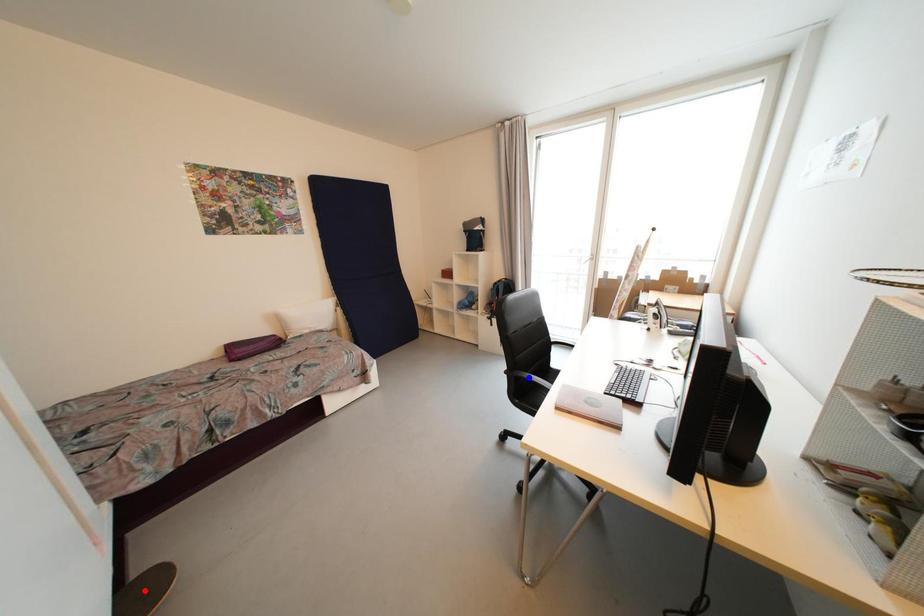
Question: In the image, two points are highlighted. Which point is nearer to the camera? Reply with the corresponding letter.

Choices:
 (A) blue point
 (B) red point

Answer: (B)